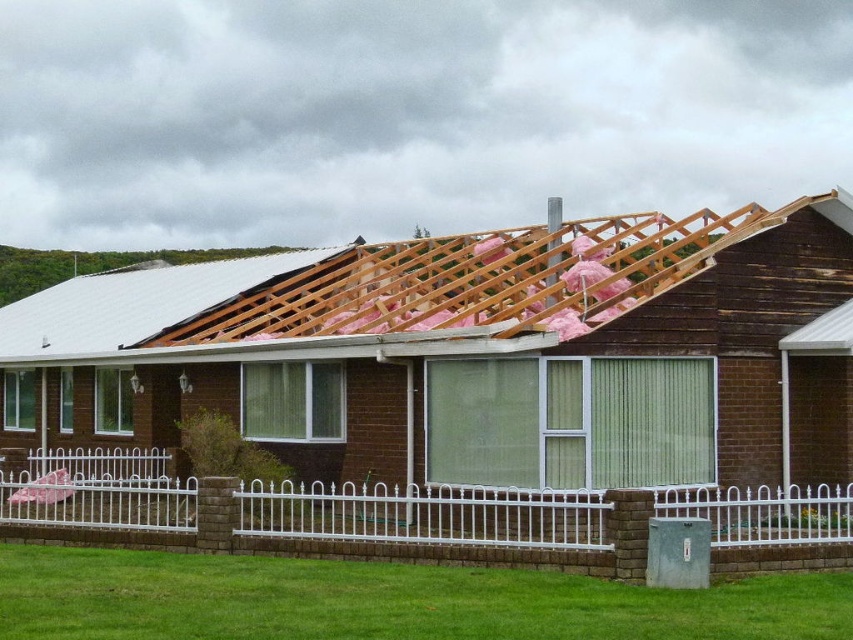
Question: Can you confirm if wooden beams at upper center is positioned below white metal fence at lower center?

Choices:
 (A) no
 (B) yes

Answer: (A)

Question: Is wooden beams at upper center to the left of white metal fence at lower center from the viewer's perspective?

Choices:
 (A) no
 (B) yes

Answer: (B)

Question: Does wooden beams at upper center have a greater width compared to white metal fence at lower center?

Choices:
 (A) yes
 (B) no

Answer: (A)

Question: Which point is farther to the camera?

Choices:
 (A) wooden beams at upper center
 (B) white metal fence at lower center

Answer: (B)